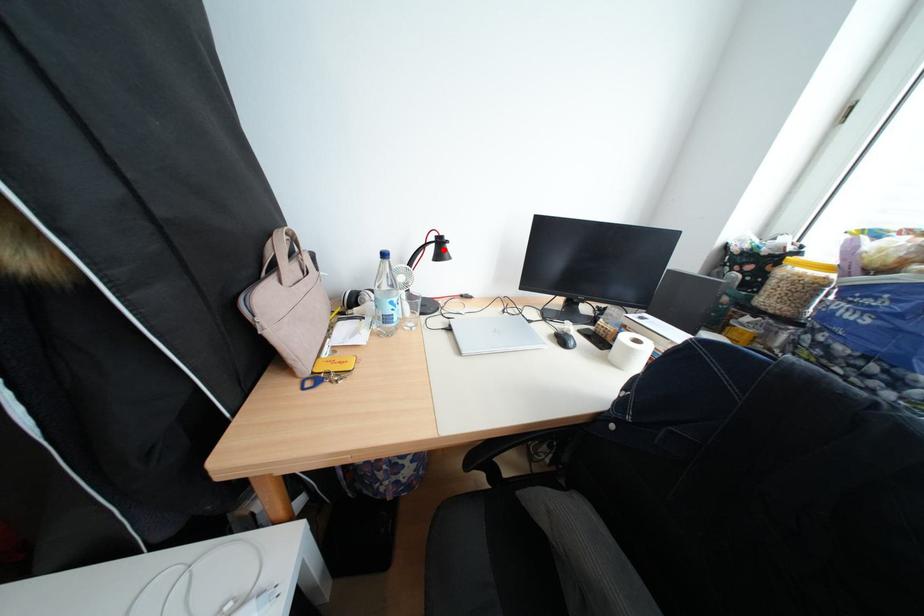
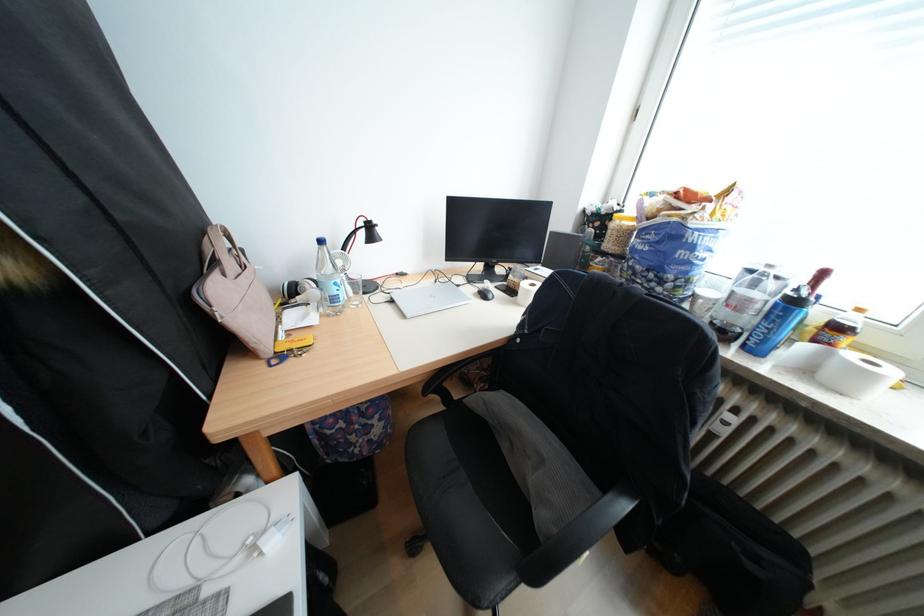
Where in the second image is the point corresponding to the highlighted location from the first image?

(374, 235)